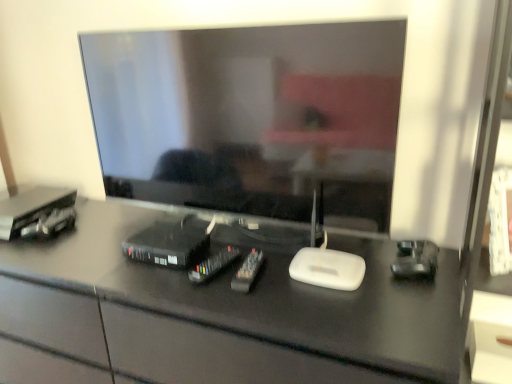
Identify the location of blank space situated above black glossy desk at center (from a real-world perspective). The height and width of the screenshot is (384, 512). (178, 238).